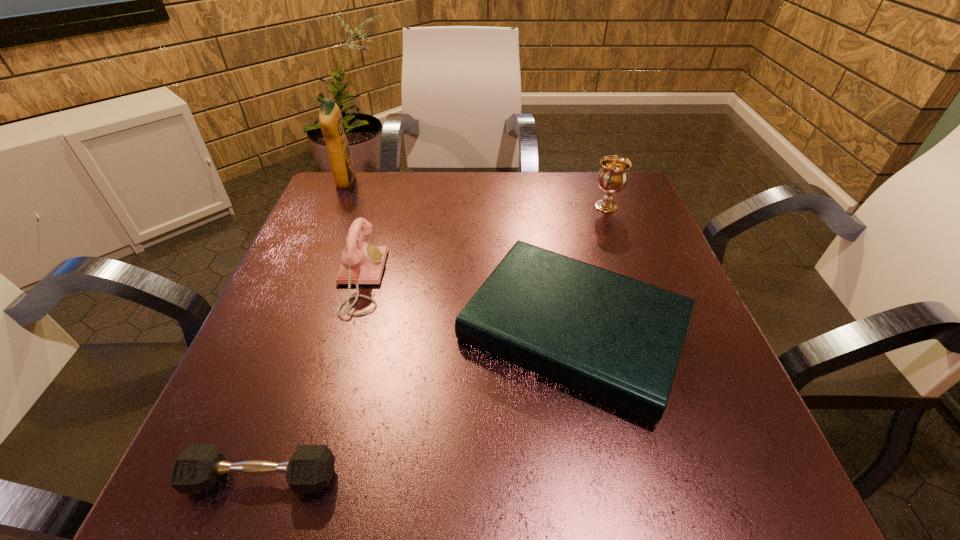
At what (x,y) coordinates should I click in order to perform the action: click on vacant region between the farthest object and the book. Please return your answer as a coordinate pair (x, y). Looking at the image, I should click on click(460, 256).

Where is `empty space that is in between the telephone and the dumbbell`? Image resolution: width=960 pixels, height=540 pixels. empty space that is in between the telephone and the dumbbell is located at coordinates (311, 379).

The image size is (960, 540). Find the location of `free space between the tallest object and the book`. free space between the tallest object and the book is located at coordinates (460, 256).

At what (x,y) coordinates should I click in order to perform the action: click on empty location between the second farthest object and the telephone. Please return your answer as a coordinate pair (x, y). The width and height of the screenshot is (960, 540). Looking at the image, I should click on (483, 243).

What are the coordinates of `vacant region between the chalice and the dumbbell` in the screenshot? It's located at (434, 342).

Image resolution: width=960 pixels, height=540 pixels. In order to click on vacant space that's between the dumbbell and the book in this screenshot , I will do `click(418, 404)`.

Select which object appears as the second closest to the detergent. Please provide its 2D coordinates. Your answer should be formatted as a tuple, i.e. [(x, y)], where the tuple contains the x and y coordinates of a point satisfying the conditions above.

[(618, 340)]

This screenshot has height=540, width=960. Find the location of `object identified as the second closest to the fourth nearest object`. object identified as the second closest to the fourth nearest object is located at coordinates (362, 263).

Identify the location of free space in the image that satisfies the following two spatial constraints: 1. on the label of the dumbbell; 2. on the left side of the farthest object. The width and height of the screenshot is (960, 540). (221, 478).

In order to click on vacant space that satisfies the following two spatial constraints: 1. on the label of the farthest object; 2. on the back side of the dumbbell in this screenshot , I will do `click(221, 478)`.